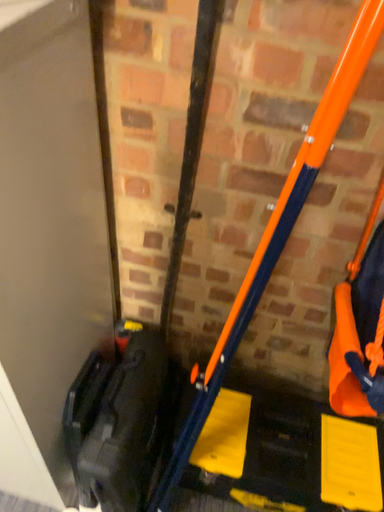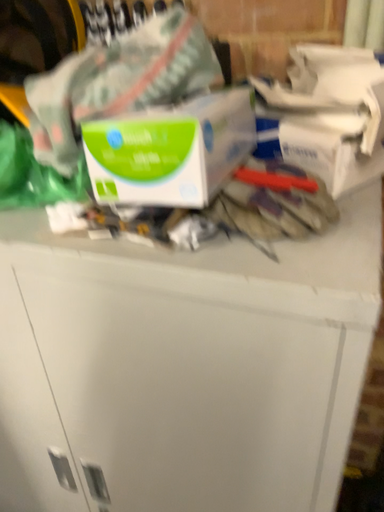
Question: Which way did the camera rotate in the video?

Choices:
 (A) rotated downward
 (B) rotated upward

Answer: (B)